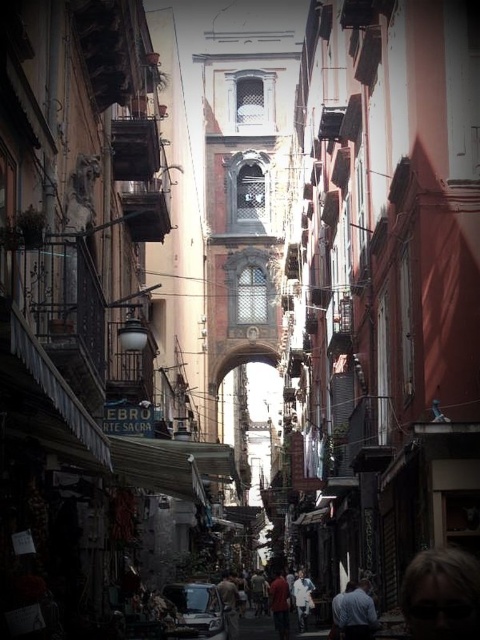
You are a delivery drone carrying a package that requires a minimum clearance of 100 feet between obstacles. You observe the blue fabric shirt at lower right and the white cotton shirt at center in the scene. Can you safely navigate between them without violating the clearance requirement?

The distance between the blue fabric shirt at lower right and the white cotton shirt at center is 111.96 feet, which exceeds the required 100 feet clearance. Therefore, the drone can safely navigate between them.

From the picture: You are a tourist in this historic city and you see two people wearing shirts. One is wearing a blue fabric shirt at lower right and the other a matte red shirt at center. Which shirt is smaller in size?

The blue fabric shirt at lower right is smaller than the matte red shirt at center.